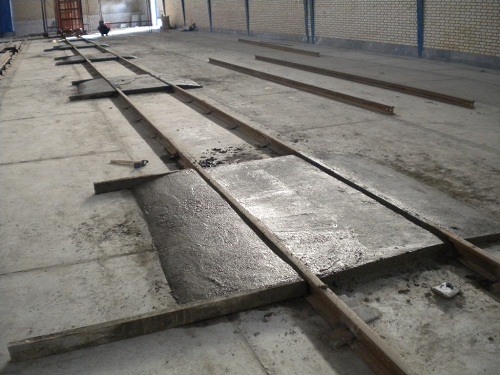
This screenshot has width=500, height=375. In order to click on upraised part of floor in this screenshot , I will do `click(5, 58)`.